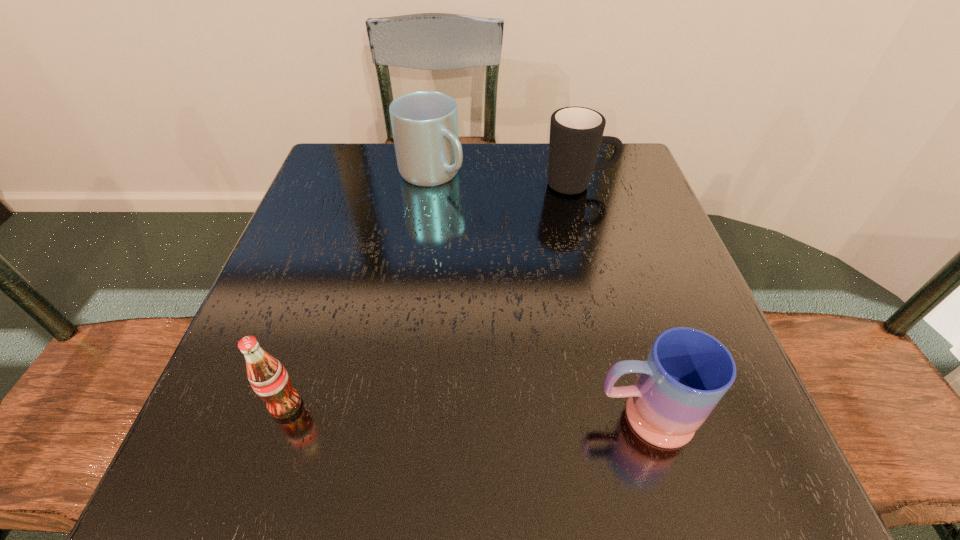
Locate an element on the screen. The height and width of the screenshot is (540, 960). the second object from left to right is located at coordinates (424, 123).

The height and width of the screenshot is (540, 960). In order to click on the leftmost object in this screenshot , I will do `click(269, 379)`.

Where is `the nearest mug`? The image size is (960, 540). the nearest mug is located at coordinates (687, 372).

Identify the location of vacant space situated on the front of the leftmost mug. The height and width of the screenshot is (540, 960). (417, 282).

Image resolution: width=960 pixels, height=540 pixels. I want to click on vacant space located 0.280m on the right of the leftmost object, so click(x=491, y=405).

In order to click on free location located on the side of the nearest mug with the handle in this screenshot , I will do 462,416.

Image resolution: width=960 pixels, height=540 pixels. In order to click on vacant space situated 0.360m on the side of the nearest mug with the handle in this screenshot , I will do `click(345, 416)`.

You are a GUI agent. You are given a task and a screenshot of the screen. Output one action in this format:
    pyautogui.click(x=<x>, y=<y>)
    Task: Click on the vacant space located 0.310m on the side of the nearest mug with the handle
    
    Given the screenshot: What is the action you would take?
    pyautogui.click(x=379, y=416)

The width and height of the screenshot is (960, 540). What are the coordinates of `object that is at the near edge` in the screenshot? It's located at [x=687, y=372].

You are a GUI agent. You are given a task and a screenshot of the screen. Output one action in this format:
    pyautogui.click(x=<x>, y=<y>)
    Task: Click on the object that is at the left edge
    
    Given the screenshot: What is the action you would take?
    pyautogui.click(x=269, y=379)